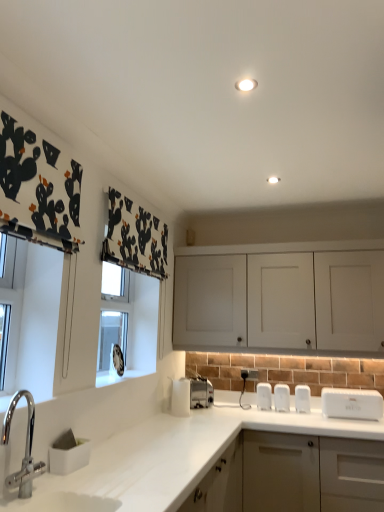
Question: Is point (31, 436) positioned closer to the camera than point (263, 387)?

Choices:
 (A) farther
 (B) closer

Answer: (B)

Question: Is brushed metal faucet at lower left bigger or smaller than white plastic salt and pepper shakers at center, which is the second appliance from left to right?

Choices:
 (A) small
 (B) big

Answer: (B)

Question: Based on their relative distances, which object is nearer to the brushed metal faucet at lower left?

Choices:
 (A) white plastic salt and pepper shakers at center, placed as the 2th appliance when sorted from right to left
 (B) white plastic electric outlet at lower center
 (C) white matte countertop at lower left
 (D) white matte cabinet at upper center, the 2th cabinetry from the bottom
 (E) matte white cabinet at lower right, placed as the first cabinetry when sorted from bottom to top

Answer: (C)

Question: Which object is the farthest from the white matte cabinet at upper center, which ranks as the 1th cabinetry in top-to-bottom order?

Choices:
 (A) satin silver toaster at lower center, arranged as the 3th appliance when viewed from the right
 (B) matte white cabinet at lower right, arranged as the 2th cabinetry when viewed from the top
 (C) white plastic toaster at right, which is counted as the first appliance, starting from the right
 (D) white plastic electric outlet at lower center
 (E) white matte countertop at lower left

Answer: (B)